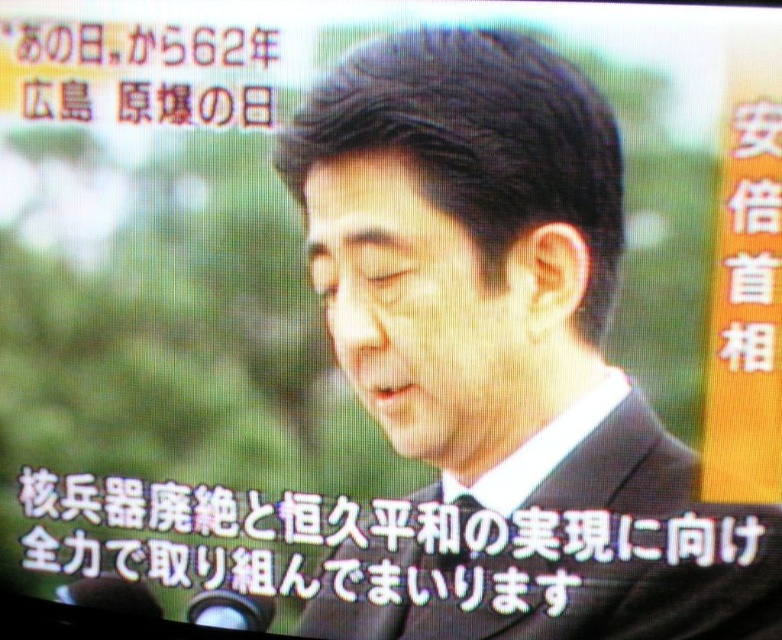
Question: Which point is farther to the camera?

Choices:
 (A) (684, 628)
 (B) (501, 566)
 (C) (734, 544)

Answer: (A)

Question: Is black suit at center below black matte text at lower center?

Choices:
 (A) yes
 (B) no

Answer: (B)

Question: Does black matte suit at center appear on the right side of black matte text at lower center?

Choices:
 (A) no
 (B) yes

Answer: (B)

Question: Estimate the real-world distances between objects in this image. Which object is farther from the black matte text at lower center?

Choices:
 (A) black suit at center
 (B) black matte suit at center

Answer: (A)

Question: Estimate the real-world distances between objects in this image. Which object is farther from the black matte text at lower center?

Choices:
 (A) black suit at center
 (B) black matte suit at center

Answer: (A)

Question: Where is black suit at center located in relation to black matte text at lower center in the image?

Choices:
 (A) above
 (B) below

Answer: (A)